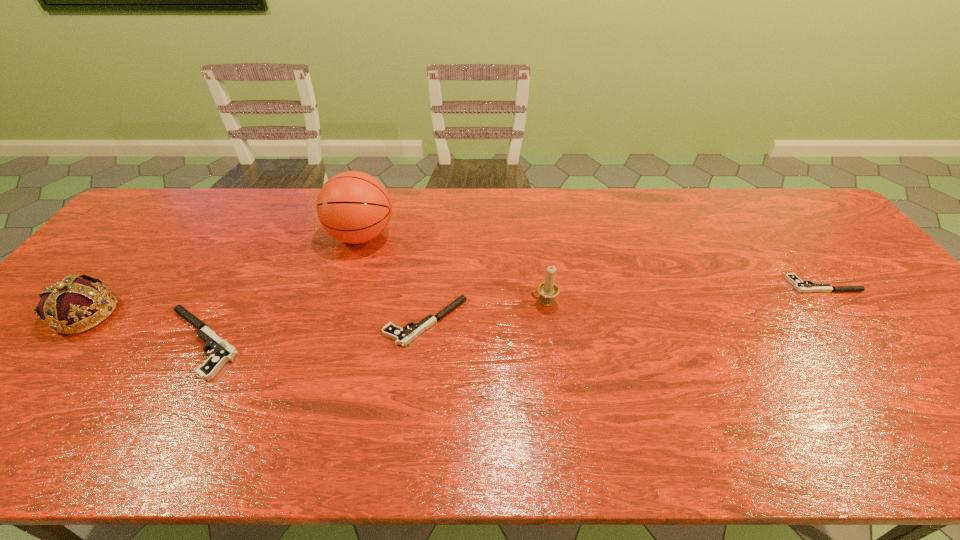
Where is `the fifth object from right to left`? the fifth object from right to left is located at coordinates pos(223,352).

The height and width of the screenshot is (540, 960). I want to click on the second pistol from left to right, so click(x=402, y=337).

At what (x,y) coordinates should I click in order to perform the action: click on the second shortest pistol. Please return your answer as a coordinate pair (x, y). This screenshot has height=540, width=960. Looking at the image, I should click on (402, 337).

Where is `the rightmost object`? Image resolution: width=960 pixels, height=540 pixels. the rightmost object is located at coordinates (801, 286).

Where is `the rightmost pistol`? This screenshot has width=960, height=540. the rightmost pistol is located at coordinates (801, 286).

Where is `the fourth object from right to left`? Image resolution: width=960 pixels, height=540 pixels. the fourth object from right to left is located at coordinates (354, 207).

Where is `the tallest object`? The width and height of the screenshot is (960, 540). the tallest object is located at coordinates (354, 207).

The image size is (960, 540). Find the location of `the leftmost object`. the leftmost object is located at coordinates (72, 299).

This screenshot has width=960, height=540. I want to click on candle_holder, so click(x=548, y=290).

Find the location of `vacant region located 0.210m on the front-facing side of the leftmost pistol`. vacant region located 0.210m on the front-facing side of the leftmost pistol is located at coordinates (72, 342).